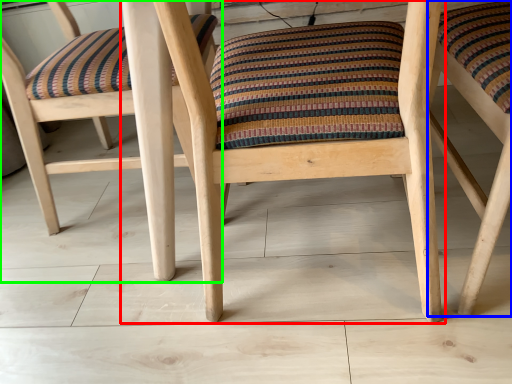
Question: Which object is the closest to the chair (highlighted by a red box)? Choose among these: chair (highlighted by a blue box) or chair (highlighted by a green box).

Choices:
 (A) chair
 (B) chair

Answer: (B)